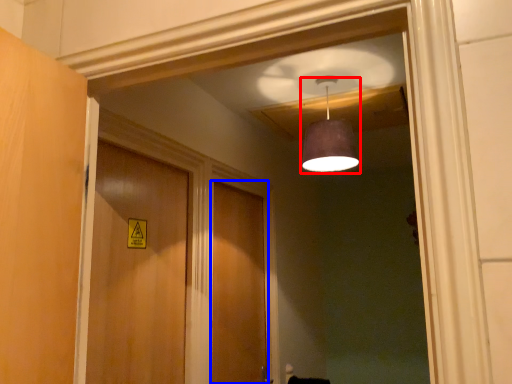
Question: Which of the following is the closest to the observer, light fixture (highlighted by a red box) or door (highlighted by a blue box)?

Choices:
 (A) light fixture
 (B) door

Answer: (A)